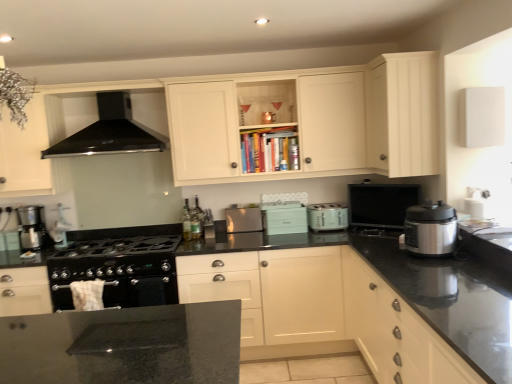
Question: Would you say white matte cabinet at upper right, marked as the 1th cabinetry in a top-to-bottom arrangement, is to the left or to the right of matte silver toaster at center, arranged as the third kitchen appliance when viewed from the left, in the picture?

Choices:
 (A) right
 (B) left

Answer: (A)

Question: Looking at their shapes, would you say white matte cabinet at upper right, the fourth cabinetry when ordered from bottom to top, is wider or thinner than matte silver toaster at center, which is the second kitchen appliance from back to front?

Choices:
 (A) wide
 (B) thin

Answer: (A)

Question: Which object is the closest to the satin silver toaster at center, the 4th kitchen appliance viewed from the front?

Choices:
 (A) matte white drawer at lower right, which is counted as the 3th cabinetry, starting from the top
 (B) light teal plastic toaster at center, the second appliance when ordered from right to left
 (C) black matte range hood at upper left
 (D) satin silver pressure cooker at right, which is the first kitchen appliance in front-to-back order
 (E) matte white cabinet at upper center, the 3th cabinetry positioned from the bottom

Answer: (B)

Question: Estimate the real-world distances between objects in this image. Which object is farther from the matte silver toaster at center, which is counted as the third kitchen appliance, starting from the front?

Choices:
 (A) metallic silver coffee maker at left, which is counted as the fourth kitchen appliance, starting from the right
 (B) black matte range hood at upper left
 (C) satin silver pressure cooker at right, positioned as the 1th kitchen appliance in right-to-left order
 (D) matte black monitor at upper right, which is counted as the second appliance, starting from the left
 (E) white matte cabinet at center, the first cabinetry positioned from the bottom

Answer: (A)